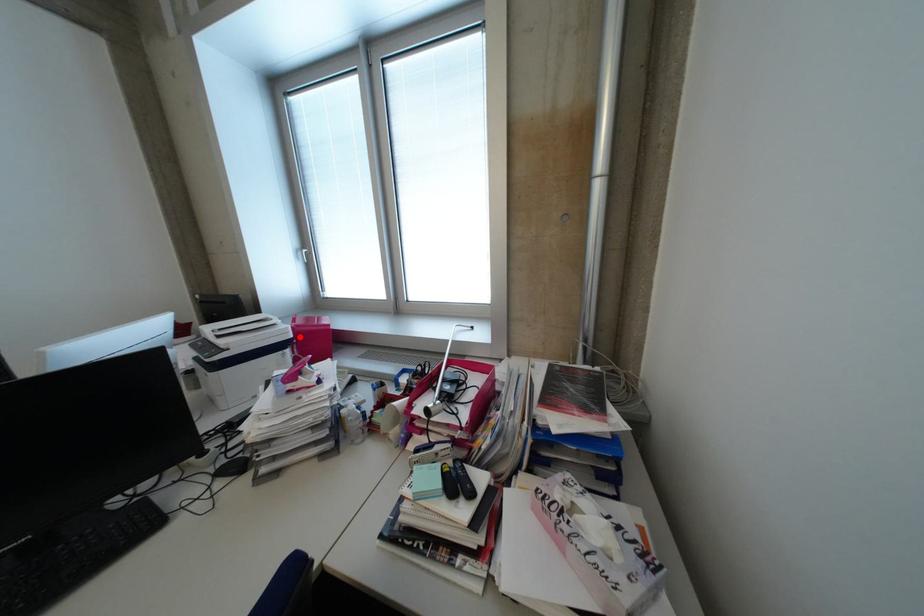
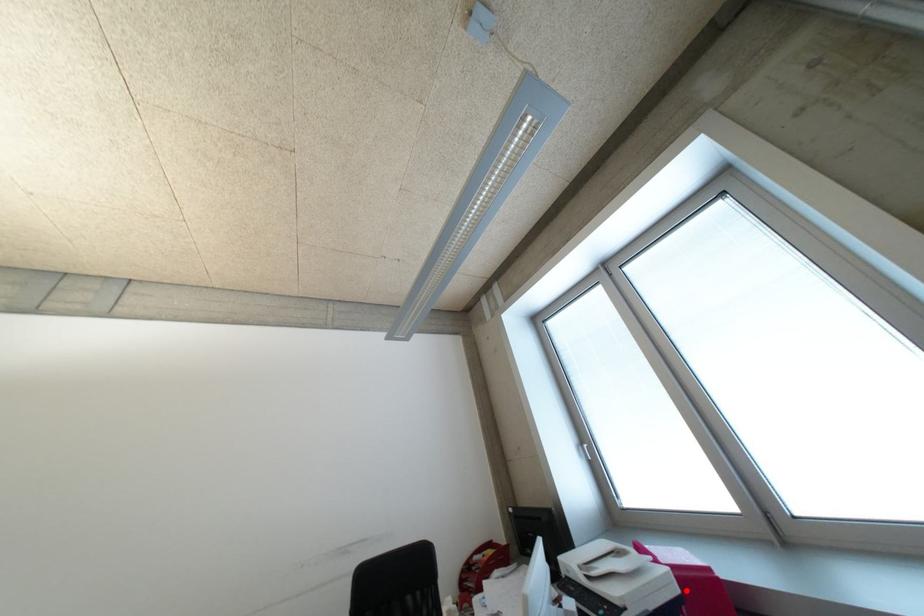
I am providing you with two images of the same scene from different viewpoints. A red point is marked on the first image and another point is marked on the second image. Do the highlighted points in image1 and image2 indicate the same real-world spot?

Yes